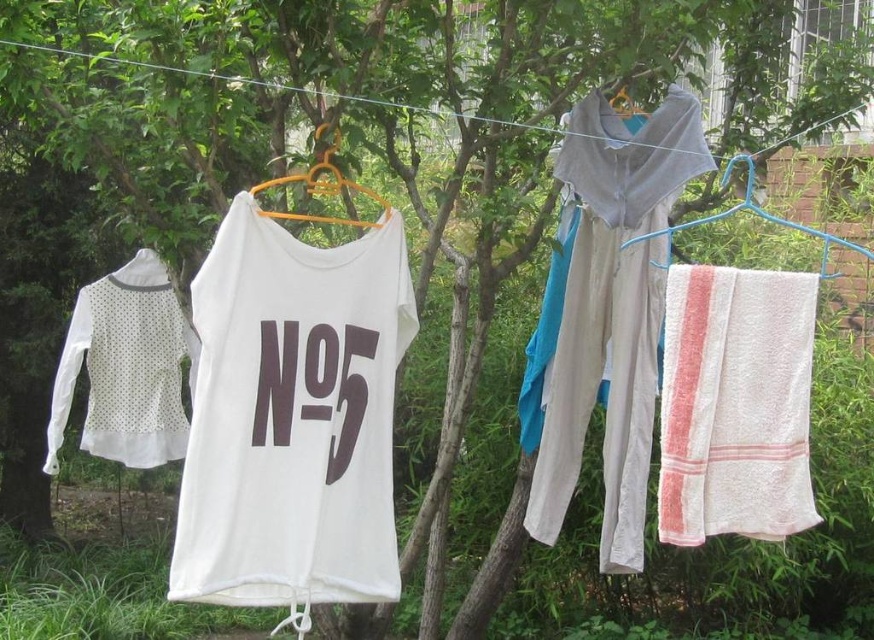
You are helping to organize the laundry on the clothesline. You need to determine which item is taller between the white dotted fabric at left and the orange plastic hanger at center. Which one is taller?

The white dotted fabric at left is taller than the orange plastic hanger at center.